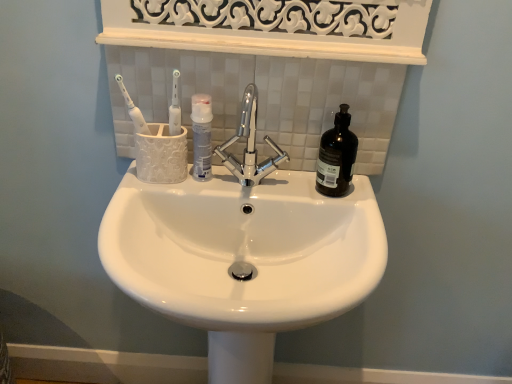
Where is `empty space that is to the right of chrome metallic faucet at center`? This screenshot has height=384, width=512. empty space that is to the right of chrome metallic faucet at center is located at coordinates point(326,192).